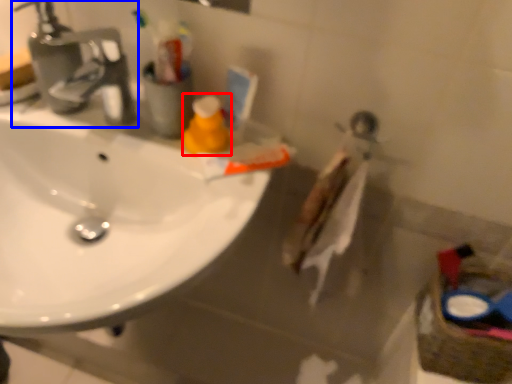
Question: Which point is further to the camera, cleaning product (highlighted by a red box) or tap (highlighted by a blue box)?

Choices:
 (A) cleaning product
 (B) tap

Answer: (A)